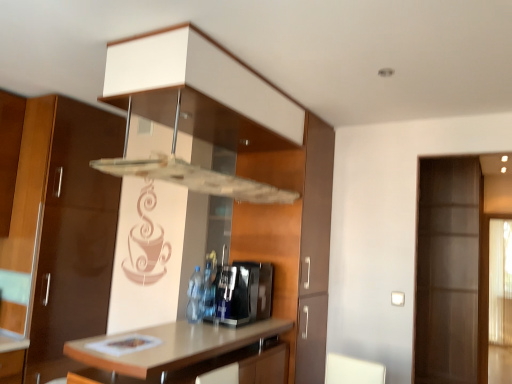
Question: From the image's perspective, is light brown laminate countertop at center under translucent plastic bottle at center?

Choices:
 (A) no
 (B) yes

Answer: (B)

Question: Is light brown laminate countertop at center looking in the opposite direction of translucent plastic bottle at center?

Choices:
 (A) no
 (B) yes

Answer: (A)

Question: Can you confirm if light brown laminate countertop at center is thinner than translucent plastic bottle at center?

Choices:
 (A) yes
 (B) no

Answer: (B)

Question: Can you confirm if light brown laminate countertop at center is shorter than translucent plastic bottle at center?

Choices:
 (A) yes
 (B) no

Answer: (B)

Question: Could translucent plastic bottle at center be considered to be inside light brown laminate countertop at center?

Choices:
 (A) no
 (B) yes

Answer: (A)

Question: Is light brown laminate countertop at center bigger than translucent plastic bottle at center?

Choices:
 (A) no
 (B) yes

Answer: (B)

Question: From the image's perspective, is light brown laminate countertop at center beneath sleek metallic coffee machine at center?

Choices:
 (A) yes
 (B) no

Answer: (A)

Question: Does light brown laminate countertop at center have a greater width compared to sleek metallic coffee machine at center?

Choices:
 (A) no
 (B) yes

Answer: (B)

Question: Does light brown laminate countertop at center contain sleek metallic coffee machine at center?

Choices:
 (A) no
 (B) yes

Answer: (A)

Question: From a real-world perspective, is light brown laminate countertop at center located beneath sleek metallic coffee machine at center?

Choices:
 (A) no
 (B) yes

Answer: (B)

Question: Is light brown laminate countertop at center next to sleek metallic coffee machine at center?

Choices:
 (A) yes
 (B) no

Answer: (B)

Question: Is light brown laminate countertop at center to the right of sleek metallic coffee machine at center from the viewer's perspective?

Choices:
 (A) yes
 (B) no

Answer: (B)

Question: Can you confirm if translucent plastic bottle at center is bigger than sleek metallic coffee machine at center?

Choices:
 (A) yes
 (B) no

Answer: (B)